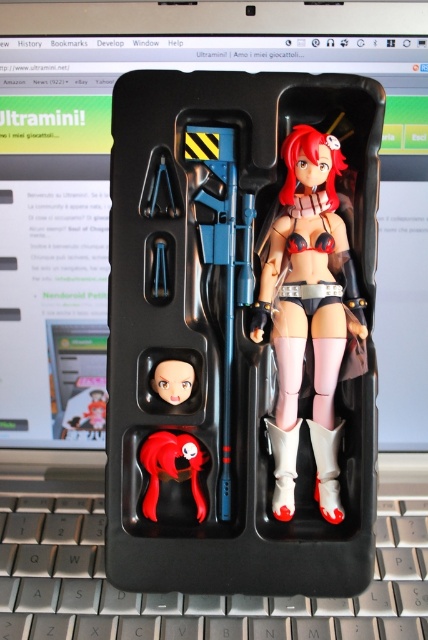
You are a collector trying to place a new accessory in the packaging. The accessory must be placed in a position that is behind both point A at point (x=347, y=618) and point B at point (x=152, y=456). Is this possible?

Since point A at point (x=347, y=618) is behind point B at point (x=152, y=456), there is no position that is behind both points simultaneously. Therefore, it is not possible to place the accessory in such a position.

Based on the scene description, where is the satin black bikini at center positioned in relation to the other objects?

The satin black bikini at center is located at point coordinates of (308, 314).